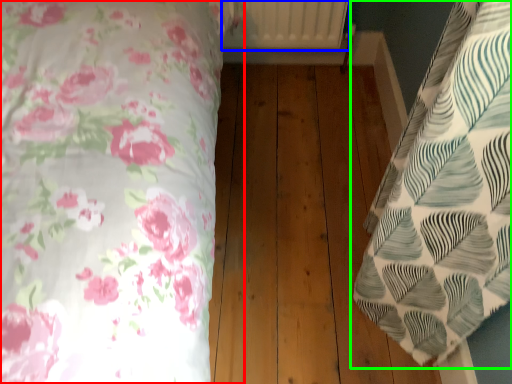
Question: Which object is positioned farthest from bed (highlighted by a red box)? Select from radiator (highlighted by a blue box) and bed (highlighted by a green box).

Choices:
 (A) radiator
 (B) bed

Answer: (A)